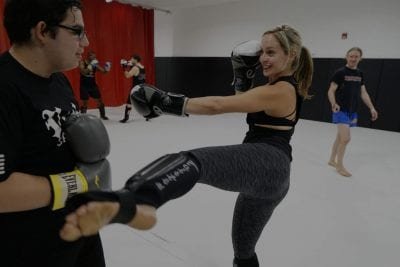
You are a GUI agent. You are given a task and a screenshot of the screen. Output one action in this format:
    pyautogui.click(x=<x>, y=<y>)
    Task: Click on the black lower half of wall
    This screenshot has height=267, width=400.
    Given the screenshot: What is the action you would take?
    pyautogui.click(x=203, y=83)